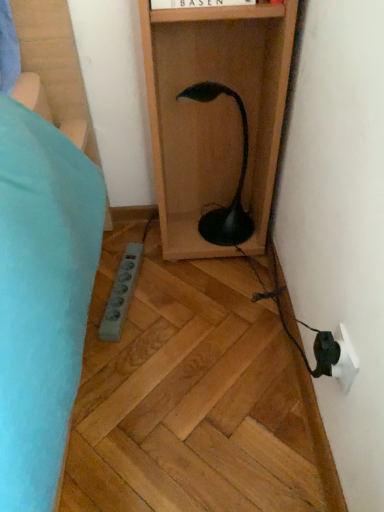
Question: Should I look upward or downward to see white plastic electric outlet at lower right?

Choices:
 (A) up
 (B) down

Answer: (B)

Question: From the image's perspective, is white plastic electric outlet at lower right over black glossy lamp at center?

Choices:
 (A) no
 (B) yes

Answer: (A)

Question: Considering the relative sizes of white plastic electric outlet at lower right and black glossy lamp at center in the image provided, is white plastic electric outlet at lower right bigger than black glossy lamp at center?

Choices:
 (A) yes
 (B) no

Answer: (B)

Question: Can you confirm if white plastic electric outlet at lower right is taller than black glossy lamp at center?

Choices:
 (A) yes
 (B) no

Answer: (B)

Question: Is white plastic electric outlet at lower right looking in the opposite direction of black glossy lamp at center?

Choices:
 (A) yes
 (B) no

Answer: (B)

Question: Does white plastic electric outlet at lower right have a lesser width compared to black glossy lamp at center?

Choices:
 (A) yes
 (B) no

Answer: (A)

Question: Is white plastic electric outlet at lower right to the left of black glossy lamp at center from the viewer's perspective?

Choices:
 (A) yes
 (B) no

Answer: (B)

Question: Can we say black glossy lamp at center lies outside white plastic electric outlet at lower right?

Choices:
 (A) yes
 (B) no

Answer: (A)

Question: Does black glossy lamp at center come behind white plastic electric outlet at lower right?

Choices:
 (A) yes
 (B) no

Answer: (A)

Question: Are black glossy lamp at center and white plastic electric outlet at lower right located far from each other?

Choices:
 (A) no
 (B) yes

Answer: (A)

Question: Considering the relative sizes of black glossy lamp at center and white plastic electric outlet at lower right in the image provided, is black glossy lamp at center taller than white plastic electric outlet at lower right?

Choices:
 (A) no
 (B) yes

Answer: (B)

Question: Is black glossy lamp at center looking in the opposite direction of white plastic electric outlet at lower right?

Choices:
 (A) no
 (B) yes

Answer: (A)

Question: From the image's perspective, is black glossy lamp at center over white plastic electric outlet at lower right?

Choices:
 (A) yes
 (B) no

Answer: (A)

Question: Considering the positions of white plastic electric outlet at lower right and black glossy lamp at center in the image, is white plastic electric outlet at lower right taller or shorter than black glossy lamp at center?

Choices:
 (A) tall
 (B) short

Answer: (B)